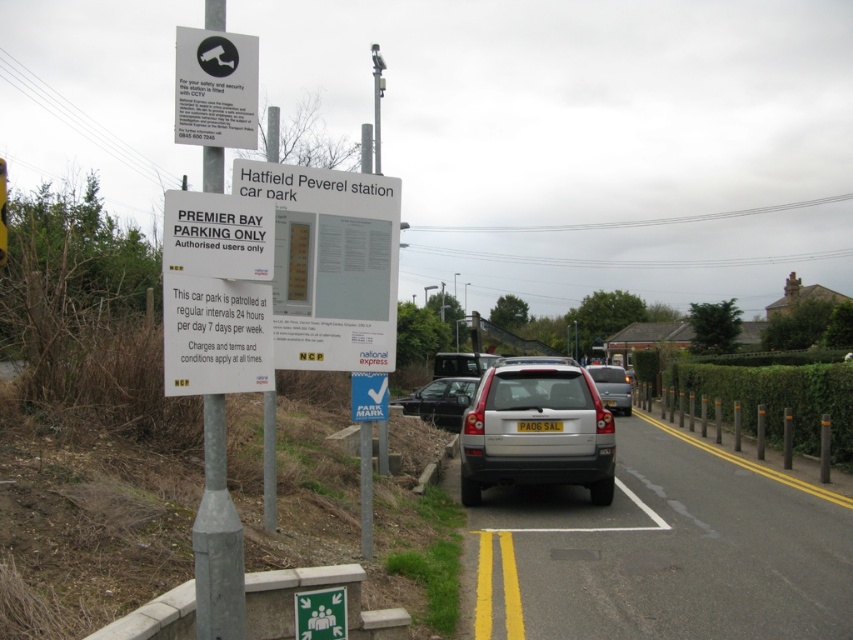
Question: Among these points, which one is nearest to the camera?

Choices:
 (A) (546, 419)
 (B) (447, 428)
 (C) (578, 456)
 (D) (206, 166)

Answer: (D)

Question: Which of these objects is positioned farthest from the green plastic sign at lower center?

Choices:
 (A) white plastic sign at upper center
 (B) silver metallic pole at center
 (C) silver metallic suv at center

Answer: (C)

Question: From the image, what is the correct spatial relationship of white plastic sign at upper center in relation to matte black car at center?

Choices:
 (A) above
 (B) below

Answer: (A)

Question: Does silver metallic pole at center lie in front of matte black car at center?

Choices:
 (A) yes
 (B) no

Answer: (A)

Question: Is silver metallic hatchback at center to the right of yellow metallic license plate at center from the viewer's perspective?

Choices:
 (A) yes
 (B) no

Answer: (A)

Question: Estimate the real-world distances between objects in this image. Which object is farther from the matte black car at center?

Choices:
 (A) white plastic sign at upper center
 (B) silver metallic hatchback at center

Answer: (A)